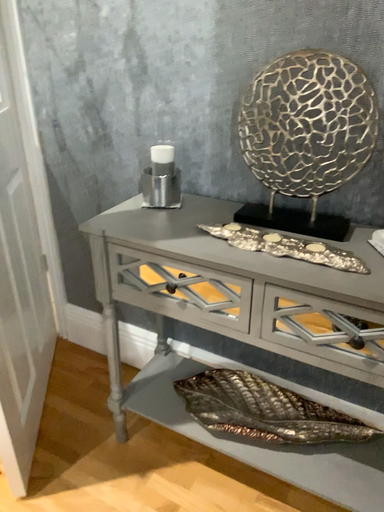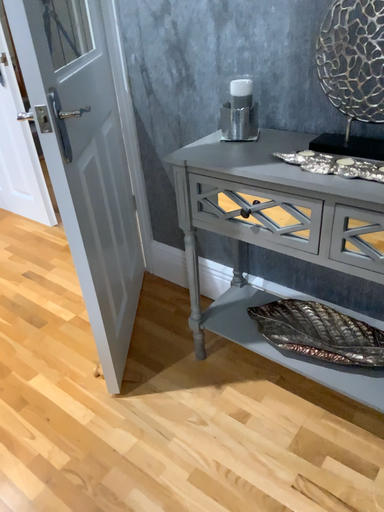
Question: How did the camera likely rotate when shooting the video?

Choices:
 (A) rotated right
 (B) rotated left

Answer: (B)